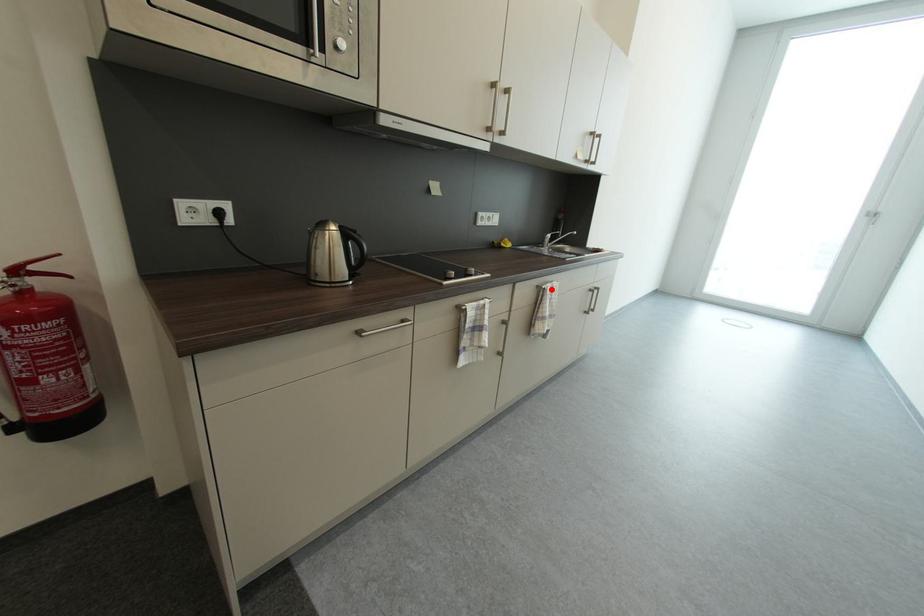
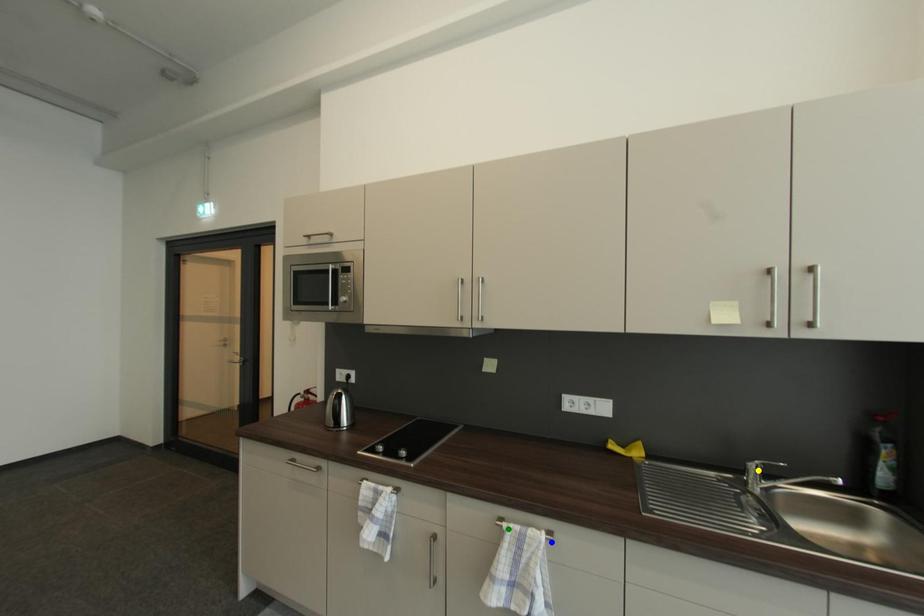
Question: I am providing you with two images of the same scene from different viewpoints. A red point is marked on the first image. You are given multiple points on the second image. In image 2, which mark is for the same physical point as the one in image 1?

Choices:
 (A) blue point
 (B) green point
 (C) yellow point

Answer: (B)